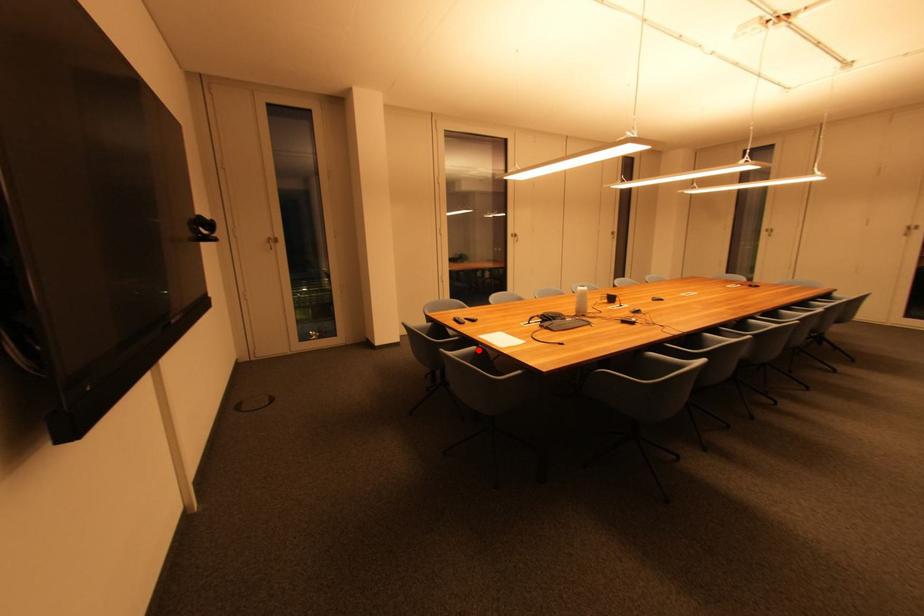
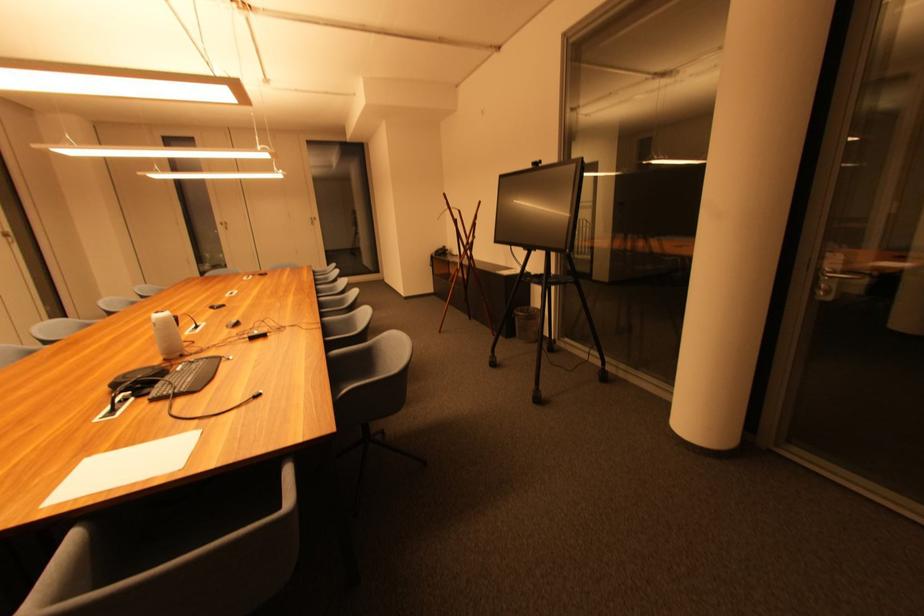
Find the pixel in the second image that matches the highlighted location in the first image.

(80, 538)